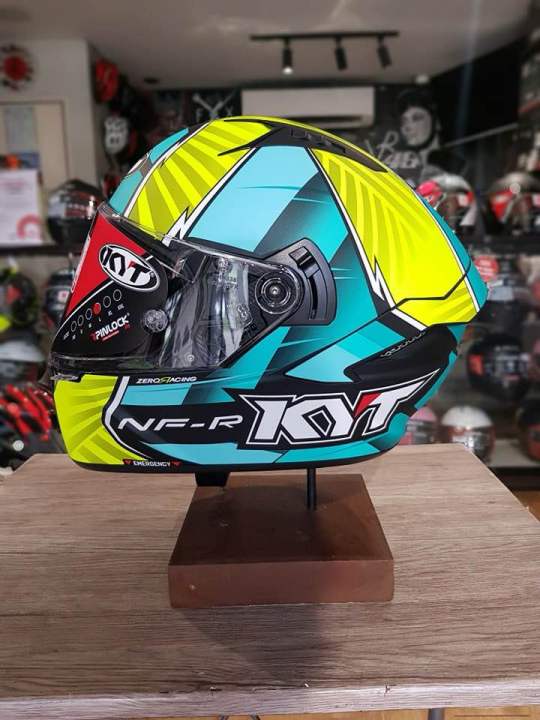
Identify the location of lights. (287, 58), (340, 55), (386, 55).